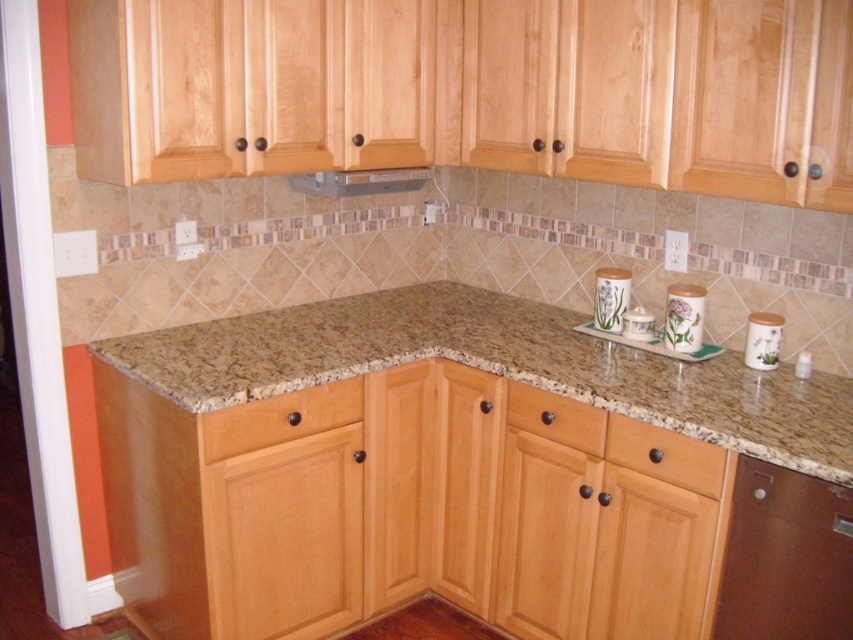
Question: Considering the relative positions of matte wood drawer at lower left and matte wood drawer at center in the image provided, where is matte wood drawer at lower left located with respect to matte wood drawer at center?

Choices:
 (A) left
 (B) right

Answer: (A)

Question: Which is nearer to the granite at center?

Choices:
 (A) matte wood drawer at center
 (B) porcelain floral-patterned canister at right
 (C) porcelain floral vase at upper right
 (D) matte wood drawer at lower left

Answer: (D)

Question: Is brown matte dishwasher at lower right below porcelain floral vase at upper right?

Choices:
 (A) no
 (B) yes

Answer: (B)

Question: Estimate the real-world distances between objects in this image. Which object is closer to the metallic stainless steel exhaust hood at upper center?

Choices:
 (A) matte wood drawer at lower left
 (B) matte wood drawer at center
 (C) porcelain floral-patterned canister at right
 (D) brown matte dishwasher at lower right

Answer: (A)

Question: Does brown matte drawer at lower center appear on the left side of metallic stainless steel exhaust hood at upper center?

Choices:
 (A) no
 (B) yes

Answer: (A)

Question: Which object is positioned farthest from the porcelain floral-patterned canister at right?

Choices:
 (A) matte wood drawer at center
 (B) matte wood drawer at lower left
 (C) white ceramic canister at right

Answer: (B)